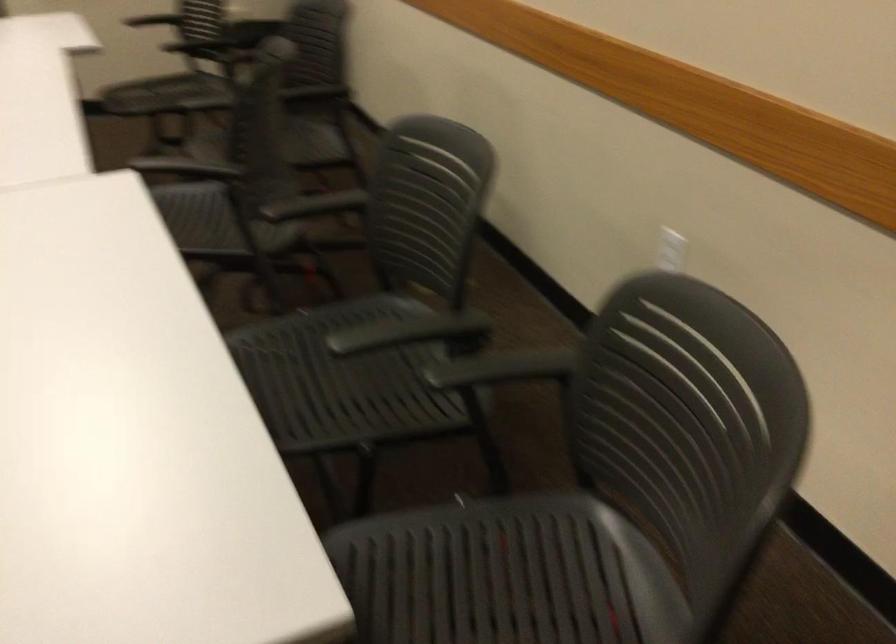
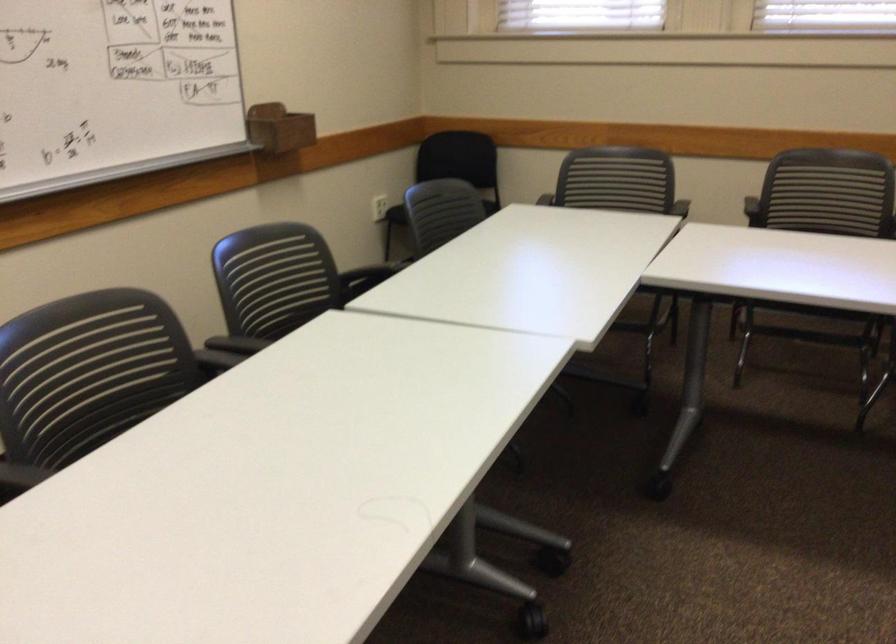
The point at (x=290, y=71) is marked in the first image. Where is the corresponding point in the second image?

(828, 200)